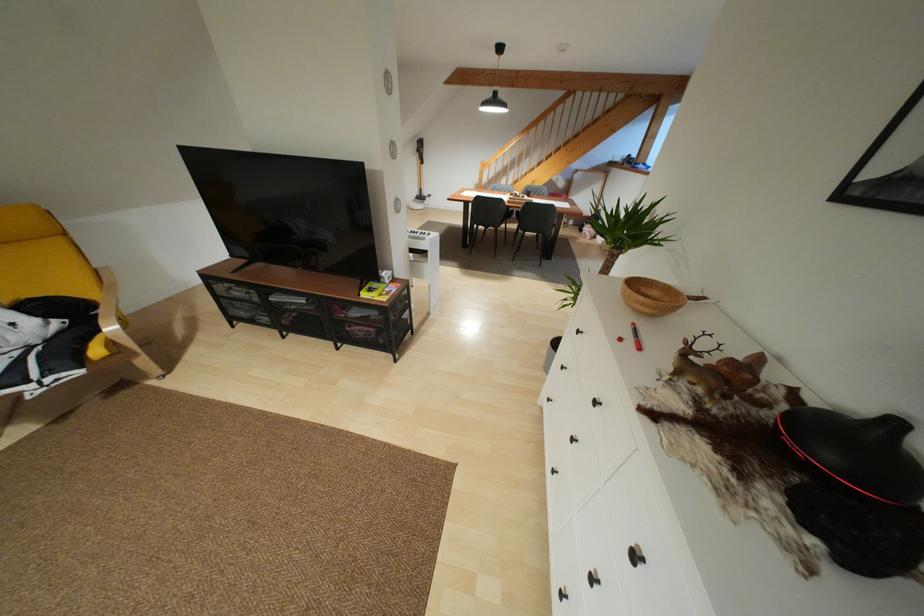
Where is `wooden chair armrest`? wooden chair armrest is located at coordinates (111, 310).